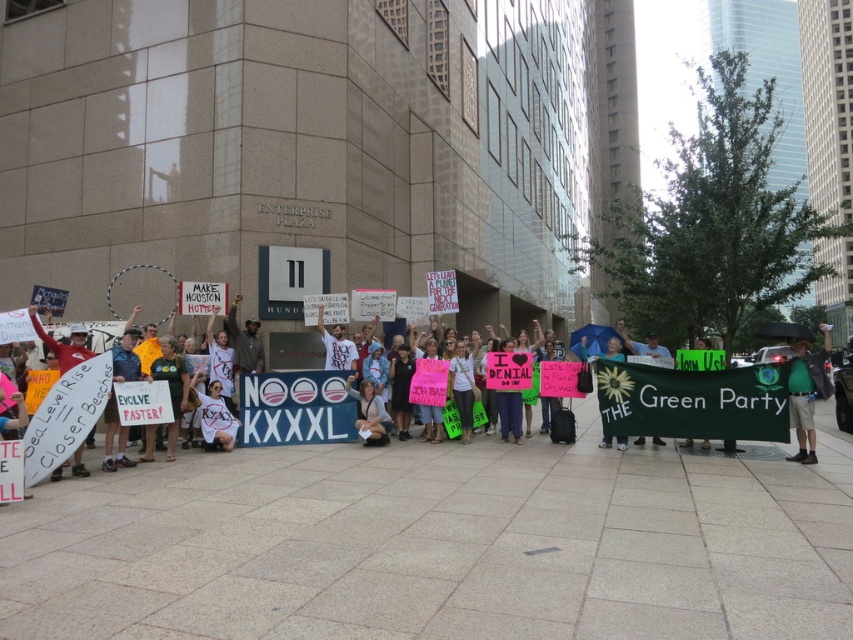
Question: Which point appears farthest from the camera in this image?

Choices:
 (A) [x=799, y=433]
 (B) [x=323, y=330]
 (C) [x=61, y=355]

Answer: (B)

Question: Is green fabric shirt at center below white cotton shirt at center?

Choices:
 (A) yes
 (B) no

Answer: (A)

Question: Is green fabric shirt at center thinner than white paper sign at left?

Choices:
 (A) yes
 (B) no

Answer: (B)

Question: Which of the following is the closest to the observer?

Choices:
 (A) white cotton shirt at center
 (B) white paper sign at left
 (C) green fabric shirt at center

Answer: (B)

Question: Does white paper sign at left appear under white cotton shirt at center?

Choices:
 (A) yes
 (B) no

Answer: (B)

Question: Which object is positioned farthest from the white cotton shirt at center?

Choices:
 (A) white paper sign at left
 (B) green fabric shirt at center

Answer: (B)